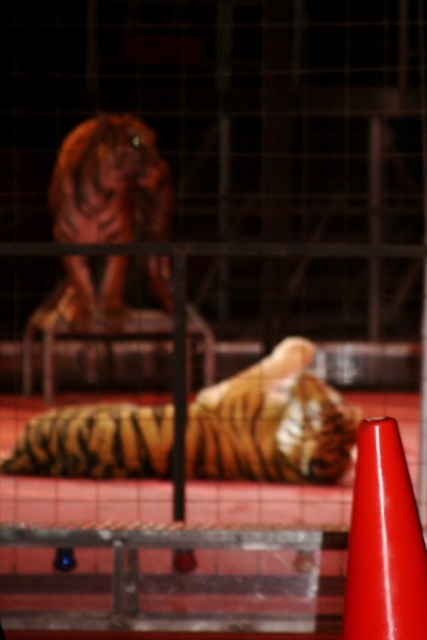
Question: Is orange-brown fur tiger at center thinner than orange-brown fur tiger at upper left?

Choices:
 (A) no
 (B) yes

Answer: (A)

Question: Which of the following is the closest to the observer?

Choices:
 (A) orange-brown fur tiger at center
 (B) smooth red traffic cone at lower right
 (C) orange-brown fur tiger at upper left

Answer: (B)

Question: Observing the image, what is the correct spatial positioning of orange-brown fur tiger at center in reference to smooth red traffic cone at lower right?

Choices:
 (A) right
 (B) left

Answer: (B)

Question: Observing the image, what is the correct spatial positioning of orange-brown fur tiger at center in reference to smooth red traffic cone at lower right?

Choices:
 (A) left
 (B) right

Answer: (A)

Question: Among these points, which one is farthest from the camera?

Choices:
 (A) (386, 500)
 (B) (88, 141)

Answer: (B)

Question: Estimate the real-world distances between objects in this image. Which object is farther from the smooth red traffic cone at lower right?

Choices:
 (A) orange-brown fur tiger at upper left
 (B) orange-brown fur tiger at center

Answer: (A)